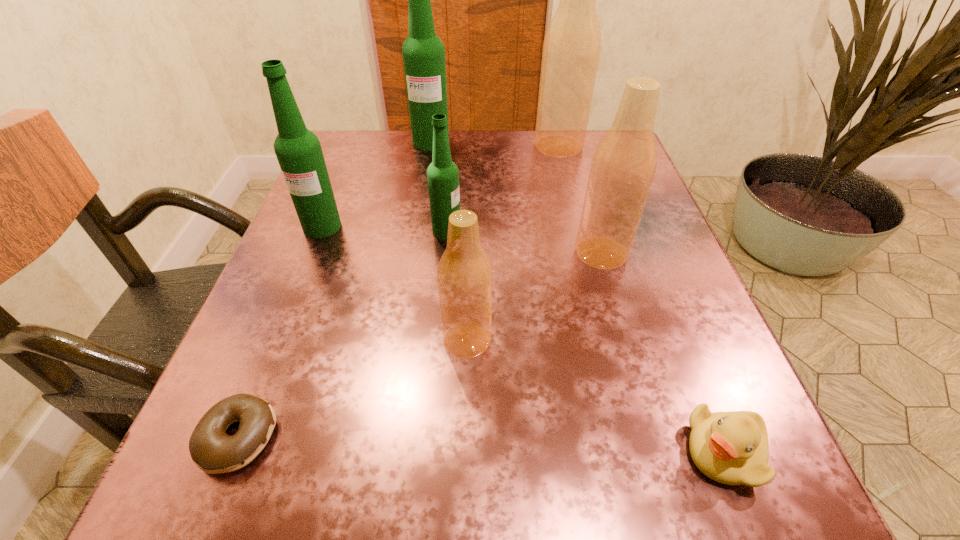
The width and height of the screenshot is (960, 540). Find the location of `free point between the second smallest green beer bottle and the yellow duckling`. free point between the second smallest green beer bottle and the yellow duckling is located at coordinates (523, 339).

Where is `vacant region between the biggest tan beer bottle and the doughnut`? Image resolution: width=960 pixels, height=540 pixels. vacant region between the biggest tan beer bottle and the doughnut is located at coordinates (397, 292).

Locate an element on the screen. The height and width of the screenshot is (540, 960). empty location between the leftmost tan beer bottle and the yellow duckling is located at coordinates (595, 396).

Where is `vacant space that is in between the biggest green beer bottle and the second biggest tan beer bottle`? vacant space that is in between the biggest green beer bottle and the second biggest tan beer bottle is located at coordinates (516, 197).

This screenshot has width=960, height=540. I want to click on vacant region between the farthest green beer bottle and the doughnut, so click(x=334, y=289).

You are a GUI agent. You are given a task and a screenshot of the screen. Output one action in this format:
    pyautogui.click(x=<x>, y=<y>)
    Task: Click on the free spot between the leftmost beer bottle and the biggest green beer bottle
    This screenshot has width=960, height=540.
    Given the screenshot: What is the action you would take?
    376,184

Where is `free space between the farthest green beer bottle and the shortest object`? Image resolution: width=960 pixels, height=540 pixels. free space between the farthest green beer bottle and the shortest object is located at coordinates coord(334,289).

Locate which object ranks second in proximity to the leftmost beer bottle. Please provide its 2D coordinates. Your answer should be formatted as a tuple, i.e. [(x, y)], where the tuple contains the x and y coordinates of a point satisfying the conditions above.

[(423, 52)]

Find the location of a particular element. This screenshot has height=540, width=960. object that ranks as the fifth closest to the sixth farthest object is located at coordinates click(x=298, y=150).

Choose which beer bottle is the nearest neighbor to the sixth farthest object. Please provide its 2D coordinates. Your answer should be formatted as a tuple, i.e. [(x, y)], where the tuple contains the x and y coordinates of a point satisfying the conditions above.

[(624, 163)]